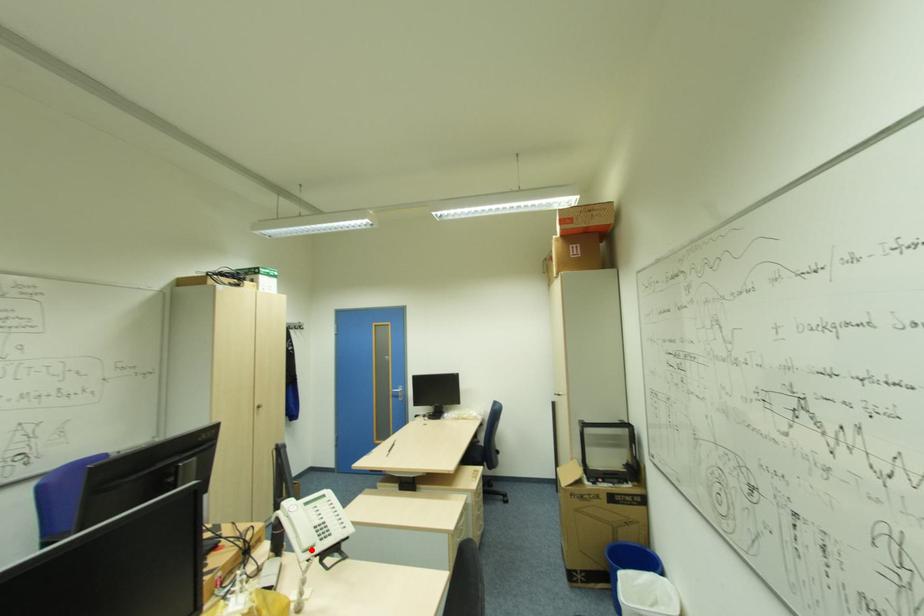
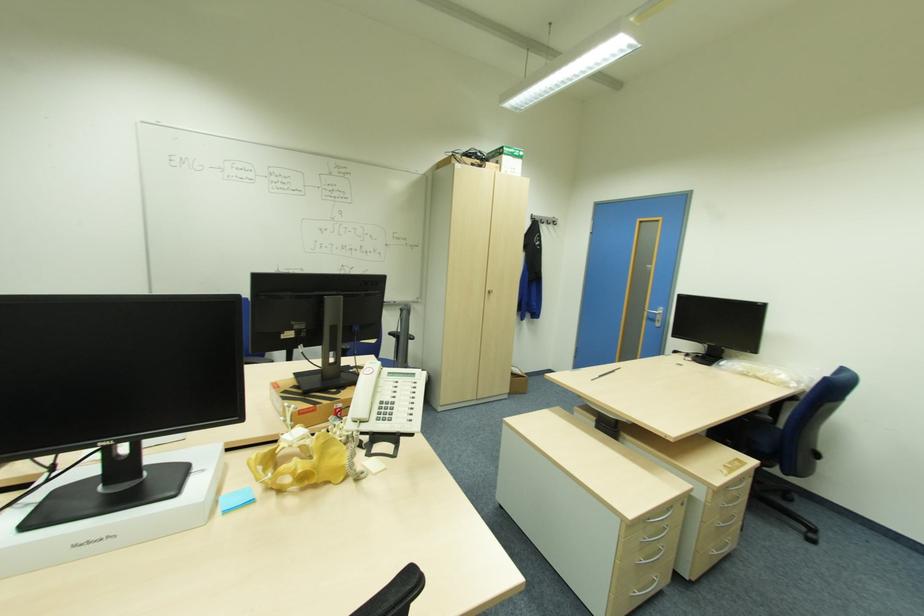
Locate, in the second image, the point that corresponds to the highlighted location in the first image.

(359, 422)